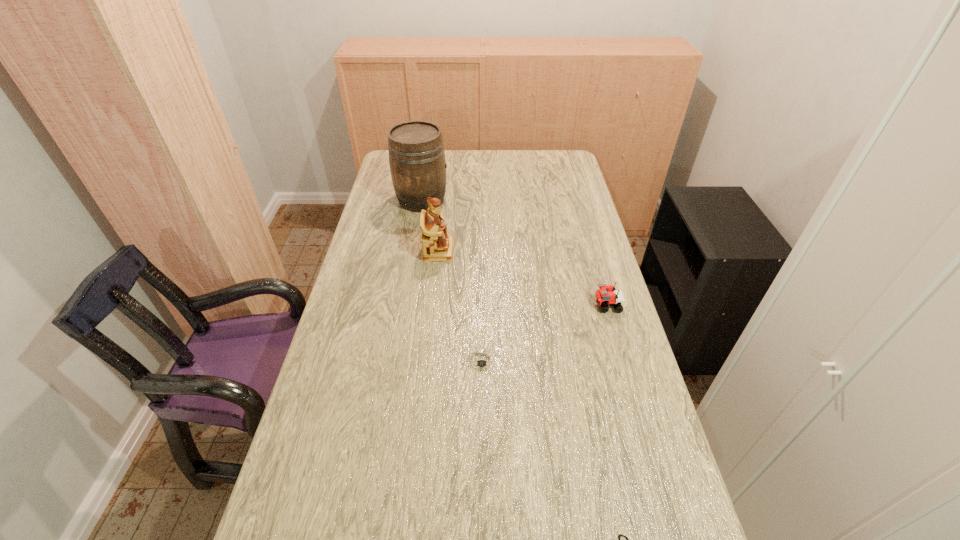
This screenshot has height=540, width=960. I want to click on the farthest object, so click(x=416, y=153).

The width and height of the screenshot is (960, 540). Find the location of `cider`. cider is located at coordinates (416, 153).

This screenshot has width=960, height=540. What are the coordinates of `the second farthest object` in the screenshot? It's located at (436, 244).

You are a GUI agent. You are given a task and a screenshot of the screen. Output one action in this format:
    pyautogui.click(x=<x>, y=<y>)
    Task: Click on the figurine
    This screenshot has height=540, width=960.
    Given the screenshot: What is the action you would take?
    pyautogui.click(x=436, y=244)

Image resolution: width=960 pixels, height=540 pixels. I want to click on the third shortest object, so click(606, 295).

You are a GUI agent. You are given a task and a screenshot of the screen. Output one action in this format:
    pyautogui.click(x=<x>, y=<y>)
    Task: Click on the Lego
    The width and height of the screenshot is (960, 540).
    Given the screenshot: What is the action you would take?
    pyautogui.click(x=606, y=295)

Identify the location of the second nearest object. Image resolution: width=960 pixels, height=540 pixels. (482, 361).

Identify the location of watch. (482, 361).

At what (x,y) coordinates should I click in order to perform the action: click on free location located on the side of the farthest object near the bung hole. Please return your answer as a coordinate pair (x, y). This screenshot has width=960, height=540. Looking at the image, I should click on (484, 200).

Find the location of `vacant area located 0.080m on the front-facing side of the second tallest object`. vacant area located 0.080m on the front-facing side of the second tallest object is located at coordinates (476, 251).